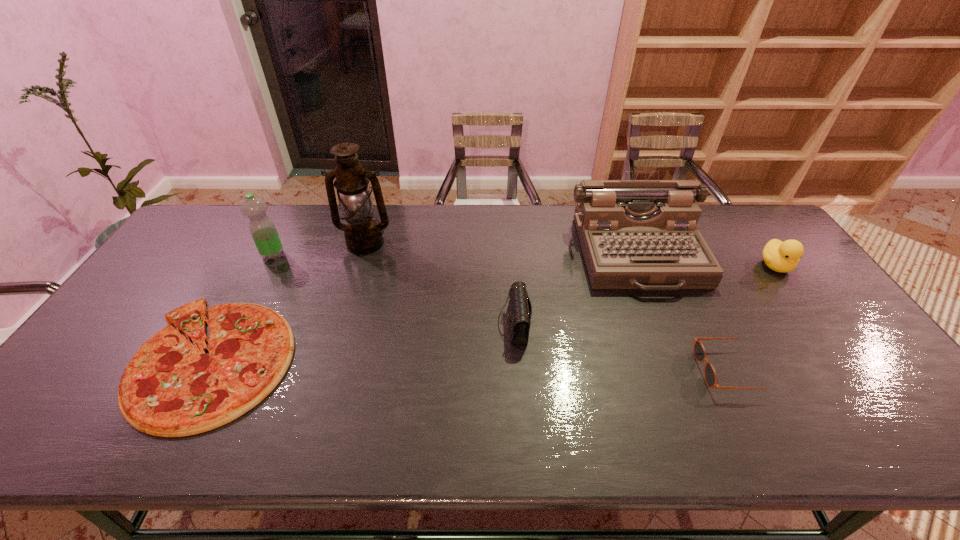
The image size is (960, 540). In order to click on vacant space at the far left corner of the desktop in this screenshot , I will do [x=212, y=232].

Identify the location of vacant region between the clutch bag and the duck. (644, 295).

Where is `free space between the third shortest object and the sunglasses`? The height and width of the screenshot is (540, 960). free space between the third shortest object and the sunglasses is located at coordinates (622, 347).

The height and width of the screenshot is (540, 960). I want to click on vacant area that lies between the oil lamp and the sixth tallest object, so click(548, 307).

At what (x,y) coordinates should I click in order to perform the action: click on free point between the fourth object from left to right and the water bottle. Please return your answer as a coordinate pair (x, y). The width and height of the screenshot is (960, 540). Looking at the image, I should click on coord(394,290).

The width and height of the screenshot is (960, 540). What are the coordinates of `vacant space that is in between the oil lamp and the shortest object` in the screenshot? It's located at (289, 302).

You are a GUI agent. You are given a task and a screenshot of the screen. Output one action in this format:
    pyautogui.click(x=<x>, y=<y>)
    Task: Click on the vacant area between the tallest object and the third shortest object
    This screenshot has width=960, height=540.
    Given the screenshot: What is the action you would take?
    pyautogui.click(x=440, y=284)

Where is `empty space that is in between the water bottle and the oil lamp`? This screenshot has height=540, width=960. empty space that is in between the water bottle and the oil lamp is located at coordinates (319, 249).

Locate an element on the screen. Image resolution: width=960 pixels, height=540 pixels. the closest object to the pizza is located at coordinates (263, 231).

You are a GUI agent. You are given a task and a screenshot of the screen. Output one action in this format:
    pyautogui.click(x=<x>, y=<y>)
    Task: Click on the object that ranks as the fourth closest to the fourth object from right to left
    
    Given the screenshot: What is the action you would take?
    pyautogui.click(x=170, y=388)